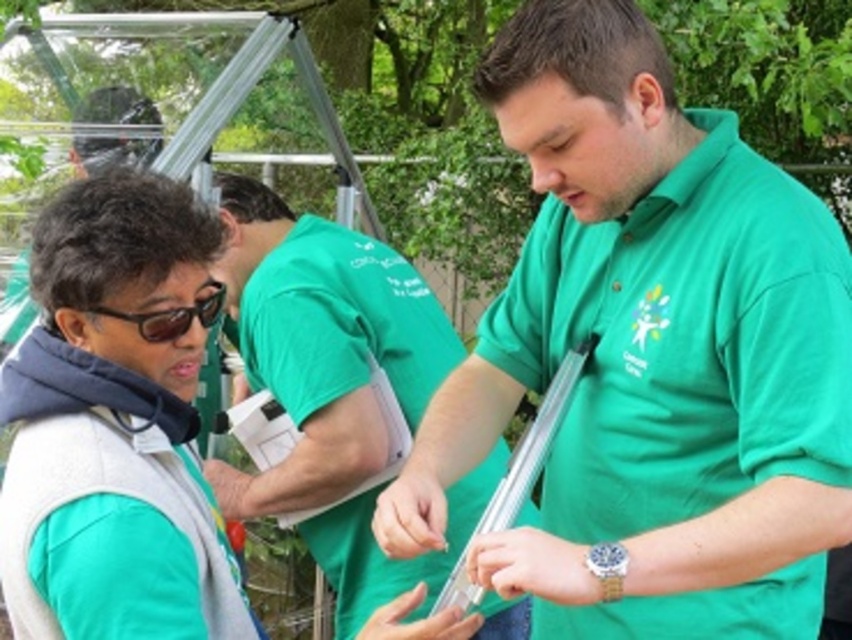
Question: Based on their relative distances, which object is nearer to the green matte shirt at center?

Choices:
 (A) black plastic goggles at upper left
 (B) green fabric shirt at center

Answer: (A)

Question: Among these objects, which one is nearest to the camera?

Choices:
 (A) green fabric shirt at center
 (B) green matte shirt at center

Answer: (B)

Question: Is green fabric shirt at center closer to camera compared to black plastic goggles at upper left?

Choices:
 (A) no
 (B) yes

Answer: (A)

Question: Is green fabric shirt at center positioned behind black plastic goggles at upper left?

Choices:
 (A) yes
 (B) no

Answer: (A)

Question: Which point is closer to the camera taking this photo?

Choices:
 (A) (329, 513)
 (B) (652, 499)

Answer: (B)

Question: From the image, what is the correct spatial relationship of green matte shirt at center in relation to black plastic goggles at upper left?

Choices:
 (A) left
 (B) right

Answer: (B)